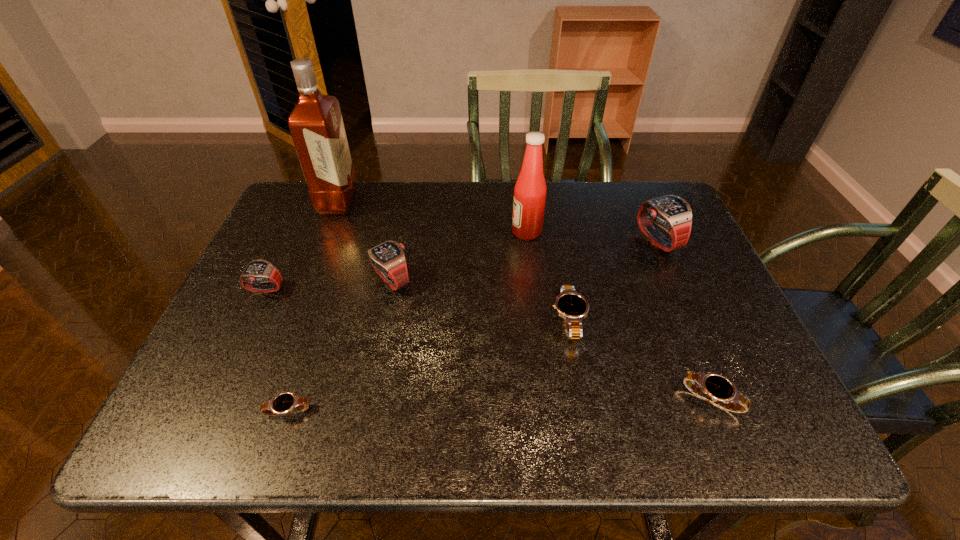
This screenshot has height=540, width=960. In order to click on the farthest black watch in this screenshot , I will do `click(570, 305)`.

Where is `the third shortest watch`? Image resolution: width=960 pixels, height=540 pixels. the third shortest watch is located at coordinates (570, 305).

At what (x,y) coordinates should I click in order to perform the action: click on the second smallest black watch. Please return your answer as a coordinate pair (x, y). This screenshot has height=540, width=960. Looking at the image, I should click on (715, 387).

Locate an element on the screen. The image size is (960, 540). the second shortest object is located at coordinates (715, 387).

Image resolution: width=960 pixels, height=540 pixels. I want to click on the shortest watch, so click(284, 403).

Where is `the leftmost black watch`? The width and height of the screenshot is (960, 540). the leftmost black watch is located at coordinates (284, 403).

Where is `blank space located on the front label of the liquor`? Image resolution: width=960 pixels, height=540 pixels. blank space located on the front label of the liquor is located at coordinates (424, 202).

Find the location of a particular element. free location located 0.270m on the front-facing side of the red condiment is located at coordinates (416, 232).

Find the location of a particular element. free space located on the front-facing side of the red condiment is located at coordinates click(493, 232).

Locate an element on the screen. The height and width of the screenshot is (540, 960). free space located on the front-facing side of the red condiment is located at coordinates click(x=466, y=232).